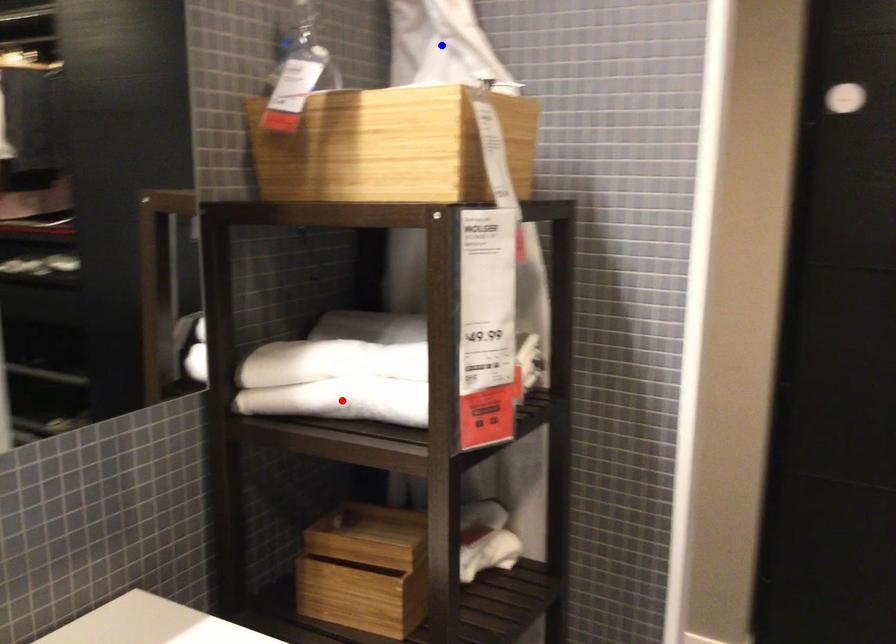
Question: In the image, two points are highlighted. Which point is nearer to the camera? Reply with the corresponding letter.

Choices:
 (A) blue point
 (B) red point

Answer: (B)